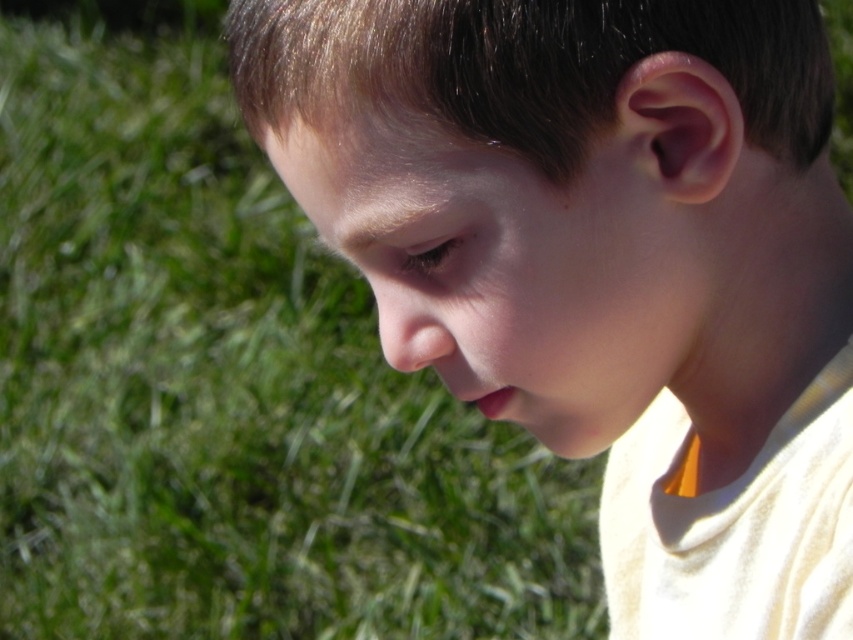
Question: Is smooth skin face at center to the left of green grass at lower left from the viewer's perspective?

Choices:
 (A) yes
 (B) no

Answer: (B)

Question: Observing the image, what is the correct spatial positioning of smooth skin face at center in reference to green grass at lower left?

Choices:
 (A) above
 (B) below

Answer: (A)

Question: Which point is farther to the camera?

Choices:
 (A) click(692, 560)
 (B) click(256, 448)

Answer: (B)

Question: Is smooth skin face at center in front of green grass at lower left?

Choices:
 (A) yes
 (B) no

Answer: (A)